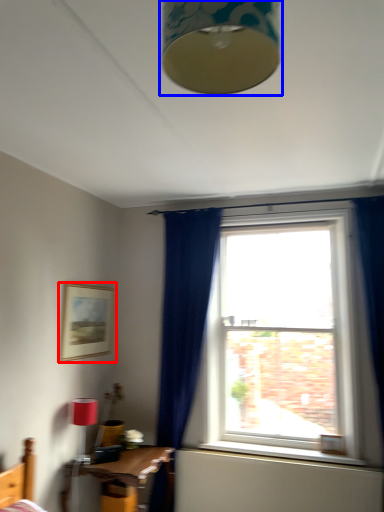
Question: Among these objects, which one is farthest to the camera, picture frame (highlighted by a red box) or lamp (highlighted by a blue box)?

Choices:
 (A) picture frame
 (B) lamp

Answer: (A)